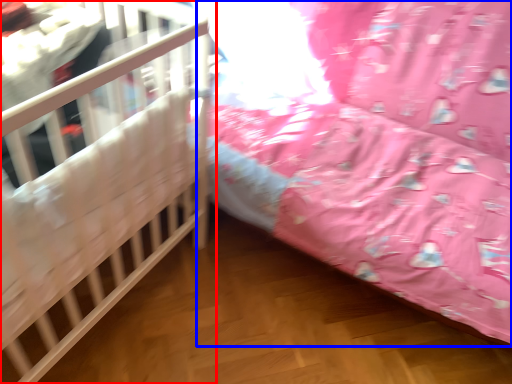
Question: Which point is closer to the camera, infant bed (highlighted by a red box) or infant bed (highlighted by a blue box)?

Choices:
 (A) infant bed
 (B) infant bed

Answer: (A)